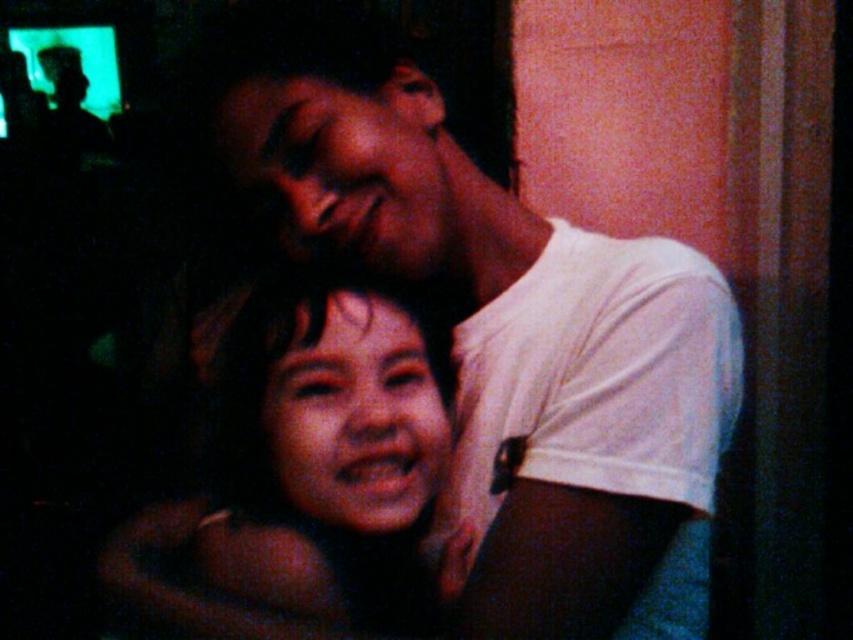
You are a photographer trying to capture a closeup of the smooth skin face at center and the white matte shirt at upper right in the scene. Since you want both subjects to be in focus, you need to know which object is larger in the frame. Which one is bigger?

The white matte shirt at upper right is bigger than the smooth skin face at center, so you should focus on the white matte shirt at upper right to ensure both are in focus.

You are a photographer trying to capture the scene. You need to adjust your camera focus to ensure both the white matte shirt at upper right and the smooth skin face at center are in focus. Which object should you focus on first to achieve this?

You should focus on the smooth skin face at center first because the white matte shirt at upper right is positioned on the right side of it, so adjusting focus starting from the closer object will help ensure both are in focus.